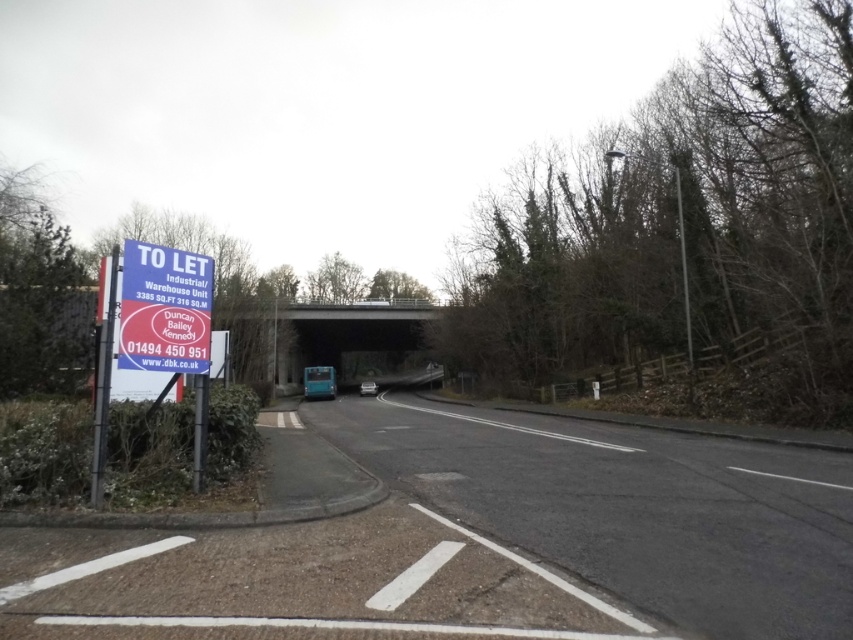
Question: Among these points, which one is farthest from the camera?

Choices:
 (A) (149, 289)
 (B) (784, 477)

Answer: (B)

Question: Does black asphalt road at center have a greater width compared to blue plastic sign at left?

Choices:
 (A) yes
 (B) no

Answer: (A)

Question: Which of the following is the closest to the observer?

Choices:
 (A) black asphalt road at center
 (B) blue plastic sign at left

Answer: (A)

Question: Is black asphalt road at center positioned behind blue plastic sign at left?

Choices:
 (A) yes
 (B) no

Answer: (B)

Question: Can you confirm if black asphalt road at center is thinner than blue plastic sign at left?

Choices:
 (A) yes
 (B) no

Answer: (B)